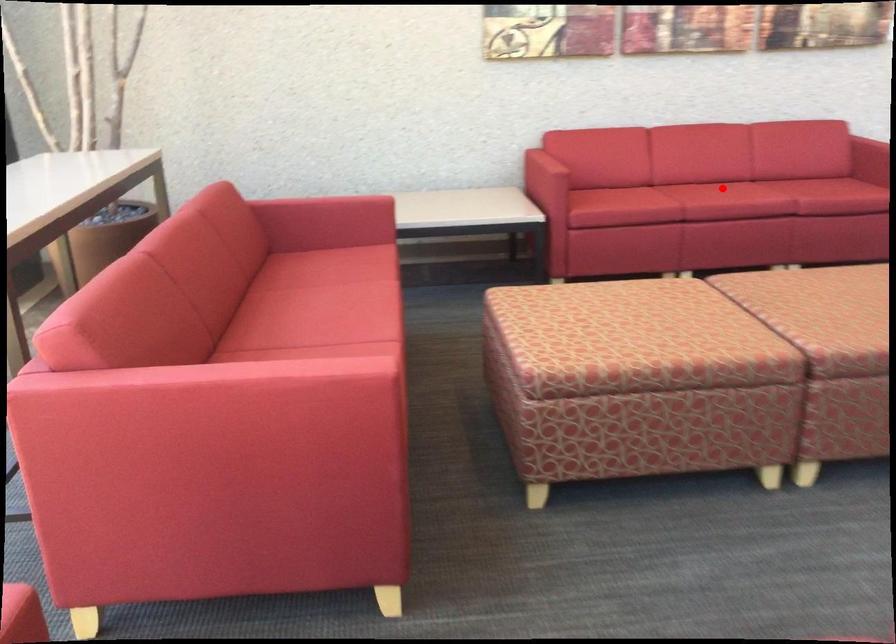
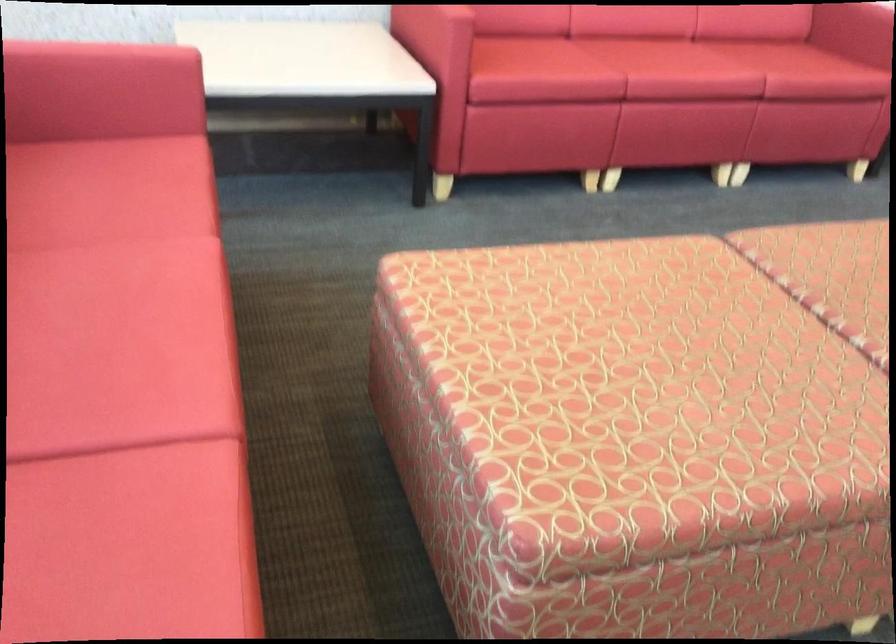
Where in the second image is the point corresponding to the highlighted location from the first image?

(677, 62)